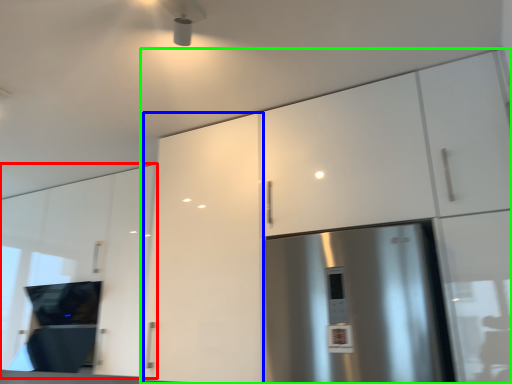
Question: Which is farther away from cabinetry (highlighted by a red box)? cabinetry (highlighted by a blue box) or cabinetry (highlighted by a green box)?

Choices:
 (A) cabinetry
 (B) cabinetry

Answer: (B)